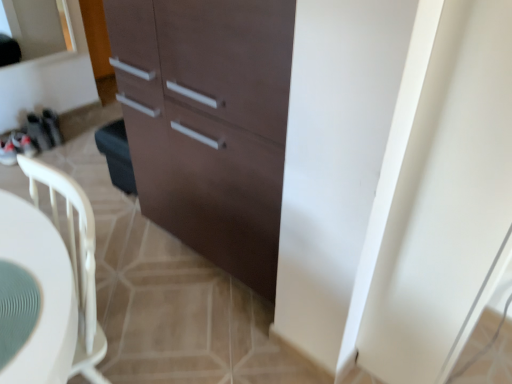
This screenshot has height=384, width=512. Identify the location of matte brown cabinet at center. (208, 122).

Based on the photo, are white plastic chair at center-left and white glossy screen door at right making contact?

No, white plastic chair at center-left is not next to white glossy screen door at right.

From a real-world perspective, is white plastic chair at center-left physically below white glossy screen door at right?

Yes, from a real-world perspective, white plastic chair at center-left is beneath white glossy screen door at right.

What's the angular difference between white plastic chair at center-left and white glossy screen door at right's facing directions?

There is a 90-degree angle between the facing directions of white plastic chair at center-left and white glossy screen door at right.

From the picture: Does teal textured placemat at lower left have a smaller size compared to white plastic chair at center-left?

Correct, teal textured placemat at lower left occupies less space than white plastic chair at center-left.

Is teal textured placemat at lower left closer to the viewer compared to white plastic chair at center-left?

That is True.

Which is more to the left, teal textured placemat at lower left or white plastic chair at center-left?

teal textured placemat at lower left.

Does teal textured placemat at lower left have a greater width compared to white plastic chair at center-left?

Indeed, teal textured placemat at lower left has a greater width compared to white plastic chair at center-left.

Between point (51, 308) and point (469, 259), which one is positioned behind?

The point (469, 259) is farther.

Considering the sizes of teal textured placemat at lower left and white glossy screen door at right in the image, is teal textured placemat at lower left bigger or smaller than white glossy screen door at right?

Considering their sizes, teal textured placemat at lower left takes up less space than white glossy screen door at right.

Which object is more forward, teal textured placemat at lower left or white glossy screen door at right?

teal textured placemat at lower left.

From the image's perspective, relative to white glossy screen door at right, is teal textured placemat at lower left above or below?

teal textured placemat at lower left is below white glossy screen door at right.

Considering the positions of points (247, 175) and (79, 355), is point (247, 175) farther from camera compared to point (79, 355)?

Yes, point (247, 175) is behind point (79, 355).

Is matte brown cabinet at center closer to the viewer compared to white plastic chair at center-left?

No, matte brown cabinet at center is behind white plastic chair at center-left.

Can you tell me how much matte brown cabinet at center and white plastic chair at center-left differ in facing direction?

They differ by 4.48e-05 degrees in their facing directions.

From the image's perspective, who appears lower, matte brown cabinet at center or white plastic chair at center-left?

From the image's view, white plastic chair at center-left is below.

Which object is thinner, white glossy screen door at right or matte brown cabinet at center?

white glossy screen door at right is thinner.

Is matte brown cabinet at center located within white glossy screen door at right?

No, matte brown cabinet at center is not inside white glossy screen door at right.

From a real-world perspective, which is physically below, white glossy screen door at right or matte brown cabinet at center?

In real-world perspective, matte brown cabinet at center is lower.

How different are the orientations of white glossy screen door at right and matte brown cabinet at center in degrees?

There is a 90-degree angle between the facing directions of white glossy screen door at right and matte brown cabinet at center.

From the image's perspective, which is above, teal textured placemat at lower left or matte brown cabinet at center?

From the image's view, matte brown cabinet at center is above.

From a real-world perspective, is teal textured placemat at lower left located beneath matte brown cabinet at center?

Incorrect, from a real-world perspective, teal textured placemat at lower left is higher than matte brown cabinet at center.

How different are the orientations of teal textured placemat at lower left and matte brown cabinet at center in degrees?

They differ by 140 degrees in their facing directions.

Is teal textured placemat at lower left behind matte brown cabinet at center?

No, it is not.

Is white glossy screen door at right spatially inside teal textured placemat at lower left, or outside of it?

white glossy screen door at right is not inside teal textured placemat at lower left, it's outside.

Is white glossy screen door at right positioned with its back to teal textured placemat at lower left?

No.

Considering the relative sizes of white glossy screen door at right and teal textured placemat at lower left in the image provided, is white glossy screen door at right thinner than teal textured placemat at lower left?

Correct, the width of white glossy screen door at right is less than that of teal textured placemat at lower left.

Who is taller, white glossy screen door at right or teal textured placemat at lower left?

white glossy screen door at right is taller.

I want to click on chair on the left of the white glossy screen door at right, so click(75, 261).

Find the location of a particular element. This screenshot has height=384, width=512. chair lying behind the teal textured placemat at lower left is located at coordinates (75, 261).

Based on their spatial positions, is white plastic chair at center-left or white glossy screen door at right closer to teal textured placemat at lower left?

white plastic chair at center-left.

Estimate the real-world distances between objects in this image. Which object is closer to matte brown cabinet at center, white glossy screen door at right or teal textured placemat at lower left?

Based on the image, white glossy screen door at right appears to be nearer to matte brown cabinet at center.

Estimate the real-world distances between objects in this image. Which object is further from matte brown cabinet at center, teal textured placemat at lower left or white plastic chair at center-left?

teal textured placemat at lower left.

Considering their positions, is teal textured placemat at lower left positioned further to white plastic chair at center-left than white glossy screen door at right?

The object further to white plastic chair at center-left is white glossy screen door at right.

When comparing their distances from teal textured placemat at lower left, does matte brown cabinet at center or white glossy screen door at right seem closer?

matte brown cabinet at center is closer to teal textured placemat at lower left.

Which object lies further to the anchor point matte brown cabinet at center, white plastic chair at center-left or teal textured placemat at lower left?

The object further to matte brown cabinet at center is teal textured placemat at lower left.

Looking at this image, from the image, which object appears to be farther from white plastic chair at center-left, white glossy screen door at right or teal textured placemat at lower left?

Among the two, white glossy screen door at right is located further to white plastic chair at center-left.

Considering their positions, is teal textured placemat at lower left positioned closer to white glossy screen door at right than white plastic chair at center-left?

Based on the image, white plastic chair at center-left appears to be nearer to white glossy screen door at right.

The width and height of the screenshot is (512, 384). I want to click on cabinetry between teal textured placemat at lower left and white glossy screen door at right in the horizontal direction, so pos(208,122).

The height and width of the screenshot is (384, 512). I want to click on cabinetry between white plastic chair at center-left and white glossy screen door at right from left to right, so click(x=208, y=122).

Locate an element on the screen. The height and width of the screenshot is (384, 512). desk between matte brown cabinet at center and white plastic chair at center-left in the up-down direction is located at coordinates (40, 293).

This screenshot has height=384, width=512. Find the location of `chair between teal textured placemat at lower left and white glossy screen door at right`. chair between teal textured placemat at lower left and white glossy screen door at right is located at coordinates (75, 261).